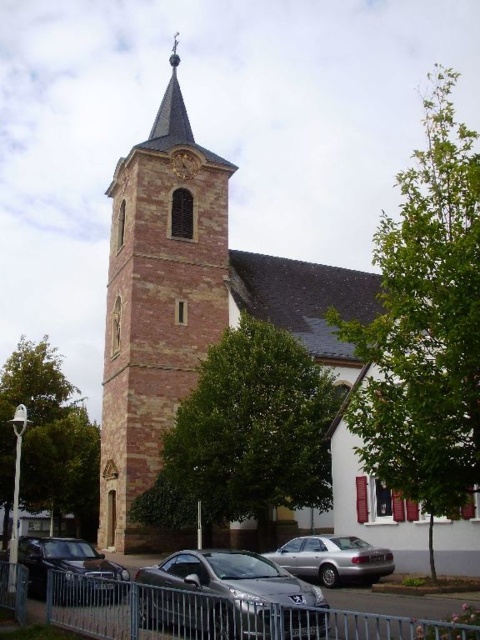
Question: Which of the following is the farthest from the observer?

Choices:
 (A) (192, 561)
 (B) (143, 490)
 (C) (189, 166)

Answer: (C)

Question: Is metallic silver fence at lower center closer to the viewer compared to satin silver sedan at center?

Choices:
 (A) no
 (B) yes

Answer: (B)

Question: Which point is closer to the camera taking this photo?

Choices:
 (A) (222, 593)
 (B) (100, 445)
 (C) (300, 576)

Answer: (A)

Question: Is red brick church at center smaller than satin silver sedan at center?

Choices:
 (A) yes
 (B) no

Answer: (B)

Question: Does reddish-brown stone tower at center-left have a smaller size compared to metallic clock at upper center?

Choices:
 (A) no
 (B) yes

Answer: (A)

Question: Which of the following is the closest to the observer?

Choices:
 (A) (314, 632)
 (B) (45, 592)
 (C) (193, 166)

Answer: (A)